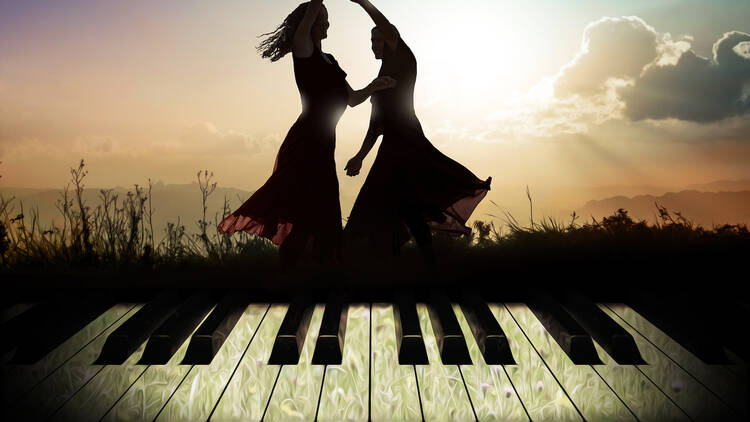
The width and height of the screenshot is (750, 422). I want to click on piano keys, so click(298, 411).